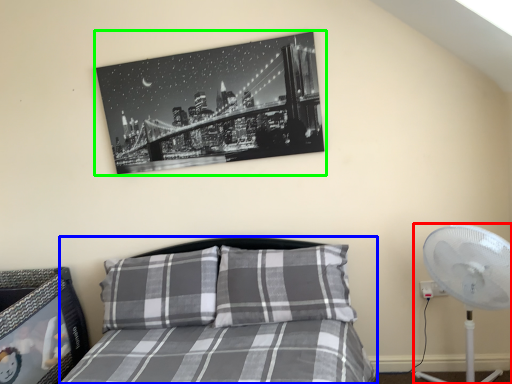
Question: Based on their relative distances, which object is nearer to mechanical fan (highlighted by a red box)? Choose from bed (highlighted by a blue box) and picture frame (highlighted by a green box).

Choices:
 (A) bed
 (B) picture frame

Answer: (A)